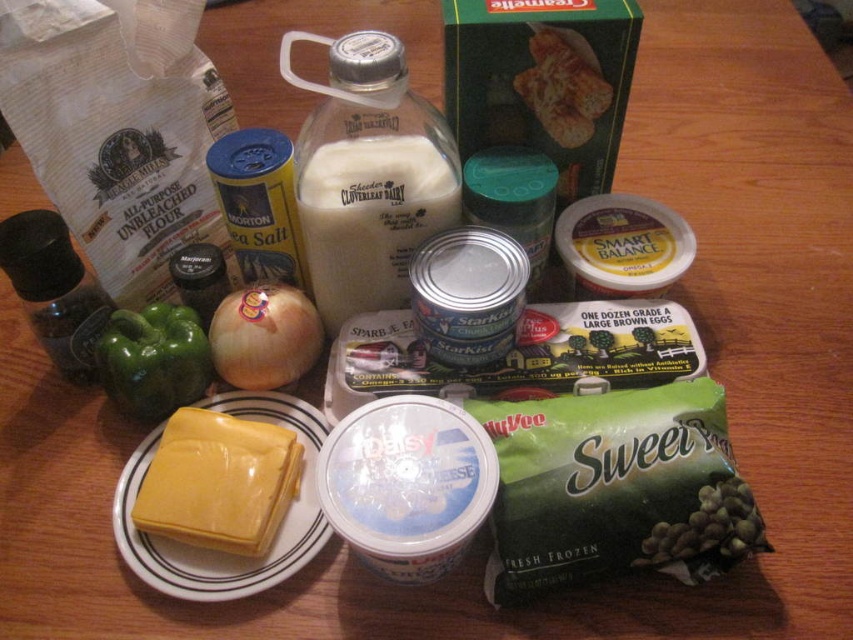
You are preparing a meal and need to chop the yellow matte onion at center and the green matte bell pepper at center left. Which vegetable should you start with if you want to work from left to right?

You should start with the green matte bell pepper at center left because it is positioned to the left of the yellow matte onion at center.

Based on the provided scene description, where is the green matte bell pepper at center left located in terms of its 2D coordinates?

The green matte bell pepper at center left is located at the 2D coordinates point (x=154, y=358).